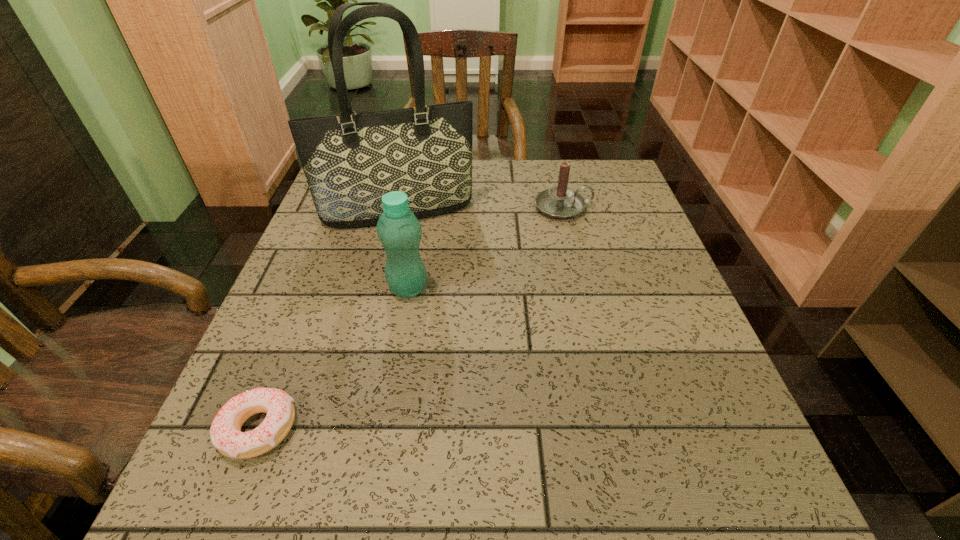
At what (x,y) coordinates should I click in order to perform the action: click on tote bag. Please return your answer as a coordinate pair (x, y). The width and height of the screenshot is (960, 540). Looking at the image, I should click on (350, 161).

In order to click on water bottle in this screenshot , I will do `click(399, 231)`.

Where is `the second nearest object`? The width and height of the screenshot is (960, 540). the second nearest object is located at coordinates (399, 231).

The height and width of the screenshot is (540, 960). Find the location of `the second shortest object`. the second shortest object is located at coordinates (561, 202).

You are a GUI agent. You are given a task and a screenshot of the screen. Output one action in this format:
    pyautogui.click(x=<x>, y=<y>)
    Task: Click on the candle
    The height and width of the screenshot is (540, 960).
    Given the screenshot: What is the action you would take?
    pyautogui.click(x=561, y=202)

You are a GUI agent. You are given a task and a screenshot of the screen. Output one action in this format:
    pyautogui.click(x=<x>, y=<y>)
    Task: Click on the shortest object
    The image size is (960, 540).
    Given the screenshot: What is the action you would take?
    pyautogui.click(x=225, y=431)

Identify the location of the nearest object. (225, 431).

The image size is (960, 540). I want to click on blank space located on the right of the tallest object, so coord(617,211).

Locate an element on the screen. free point located 0.180m at the front cap of the water bottle is located at coordinates (514, 288).

Find the location of a particular element. vacant space located 0.070m on the side of the second shortest object with the handle loop is located at coordinates (618, 207).